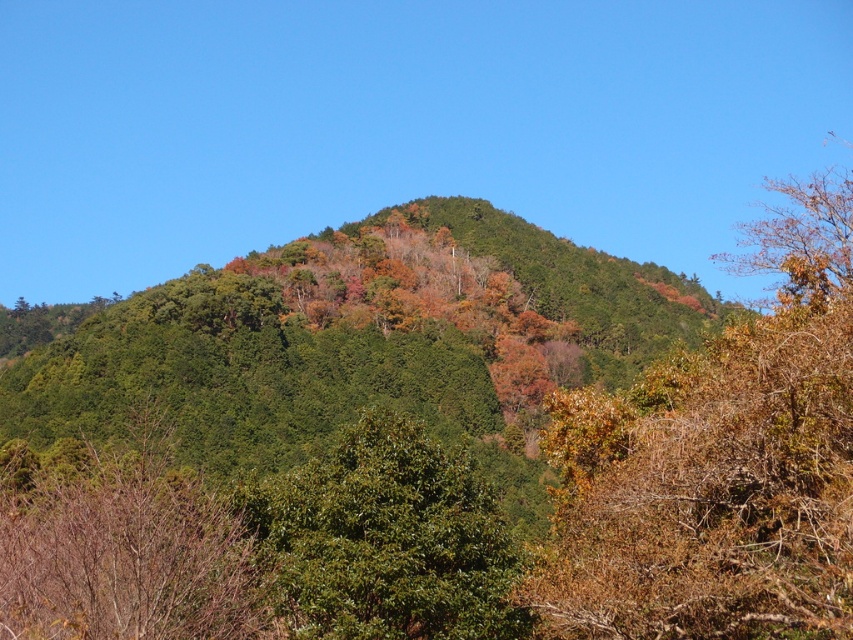
Question: Does green matte tree at center appear under green glossy bush at center?

Choices:
 (A) no
 (B) yes

Answer: (B)

Question: Among these objects, which one is farthest from the camera?

Choices:
 (A) brown leafy bush at right
 (B) green glossy bush at center
 (C) green matte tree at center

Answer: (B)

Question: From the image, what is the correct spatial relationship of green matte tree at center in relation to green glossy bush at center?

Choices:
 (A) left
 (B) right

Answer: (A)

Question: Is brown leafy bush at right to the left of green glossy bush at center from the viewer's perspective?

Choices:
 (A) yes
 (B) no

Answer: (B)

Question: Which is farther from the green matte tree at center?

Choices:
 (A) green glossy bush at center
 (B) brown leafy bush at right

Answer: (B)

Question: Among these objects, which one is farthest from the camera?

Choices:
 (A) brown leafy bush at right
 (B) green glossy bush at center

Answer: (B)